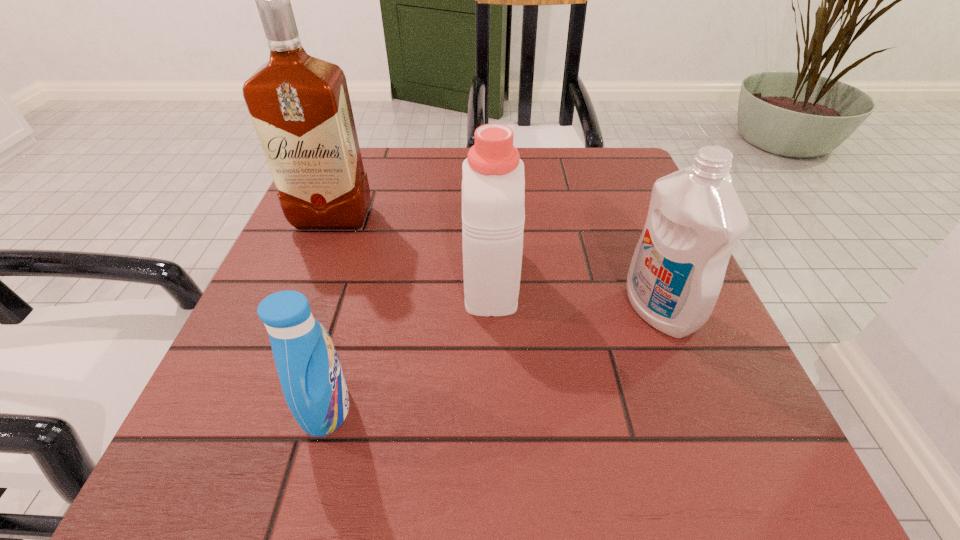
Locate an element on the screen. the farthest object is located at coordinates (300, 106).

You are a GUI agent. You are given a task and a screenshot of the screen. Output one action in this format:
    pyautogui.click(x=<x>, y=<y>)
    Task: Click on the tallest object
    
    Given the screenshot: What is the action you would take?
    pyautogui.click(x=300, y=106)

This screenshot has height=540, width=960. What are the coordinates of `the rightmost detergent` in the screenshot? It's located at (695, 219).

Where is `the second detergent from left to right`? The width and height of the screenshot is (960, 540). the second detergent from left to right is located at coordinates (493, 186).

Identify the location of the shortest object. This screenshot has height=540, width=960. (310, 372).

This screenshot has height=540, width=960. I want to click on the leftmost detergent, so click(x=310, y=372).

Locate an element on the screen. The height and width of the screenshot is (540, 960). blank area located on the front label of the liquor is located at coordinates (321, 250).

The width and height of the screenshot is (960, 540). What are the coordinates of `vacant space located 0.280m on the back of the rightmost object` in the screenshot? It's located at (613, 193).

Locate an element on the screen. vacant area located on the handle side of the second detergent from right to left is located at coordinates (488, 167).

In order to click on vacant point located 0.370m on the handle side of the second detergent from right to left in this screenshot , I will do `click(488, 151)`.